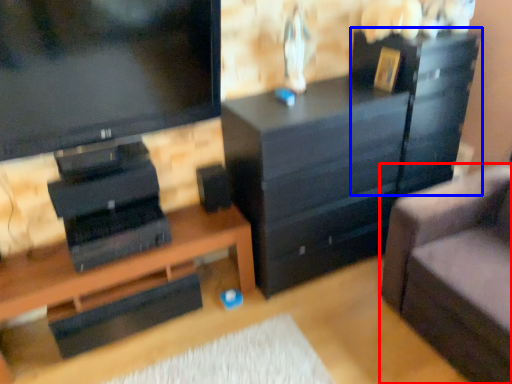
Question: Among these objects, which one is farthest to the camera, studio couch (highlighted by a red box) or file cabinet (highlighted by a blue box)?

Choices:
 (A) studio couch
 (B) file cabinet

Answer: (B)